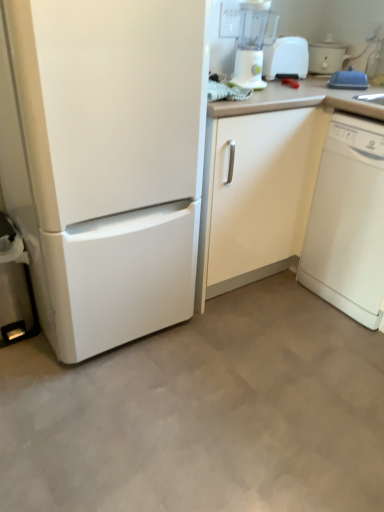
Question: From the image's perspective, is white plastic blender at upper right above or below white matte refrigerator at left?

Choices:
 (A) above
 (B) below

Answer: (A)

Question: Considering the positions of point click(246, 56) and point click(107, 20), is point click(246, 56) closer or farther from the camera than point click(107, 20)?

Choices:
 (A) farther
 (B) closer

Answer: (A)

Question: Which object is positioned farthest from the blue plastic lid at upper right?

Choices:
 (A) white matte refrigerator at left
 (B) white plastic cooker at upper right
 (C) white glossy cabinet at center
 (D) white plastic toaster at upper right
 (E) white glossy dishwasher at right

Answer: (A)

Question: Estimate the real-world distances between objects in this image. Which object is closer to the white glossy dishwasher at right?

Choices:
 (A) blue plastic lid at upper right
 (B) white plastic blender at upper right
 (C) white plastic cooker at upper right
 (D) white plastic toaster at upper right
 (E) white matte refrigerator at left

Answer: (A)